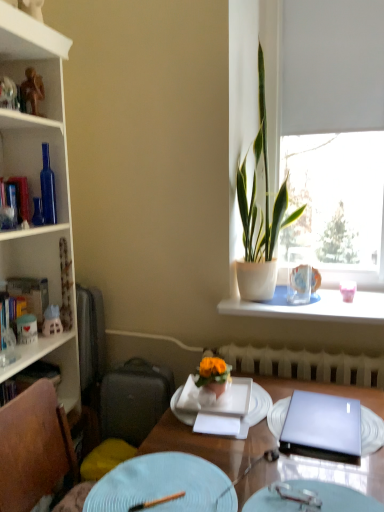
The height and width of the screenshot is (512, 384). What are the coordinates of `vacant space to the left of satin purple laptop at center` in the screenshot? It's located at (248, 437).